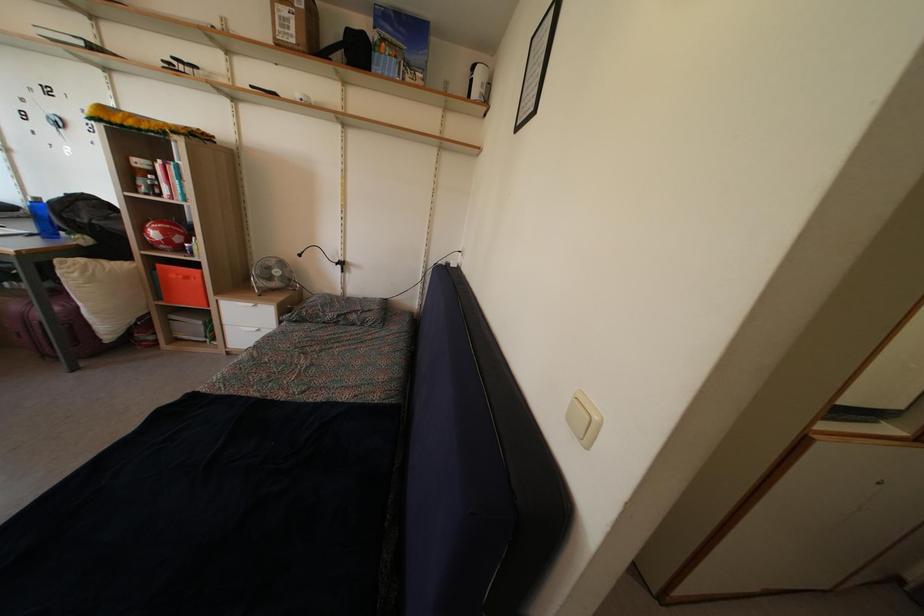
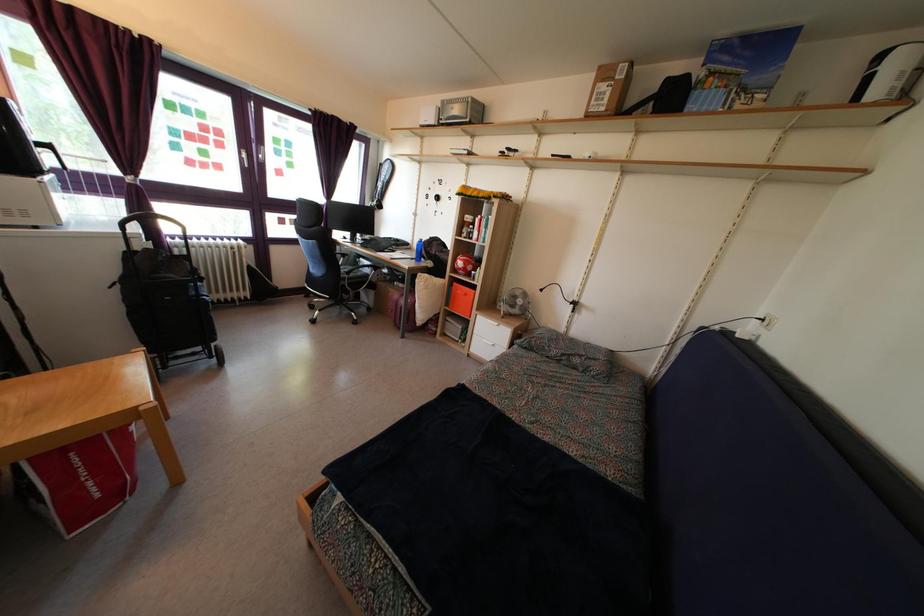
The point at (157, 243) is marked in the first image. Where is the corresponding point in the second image?

(463, 272)